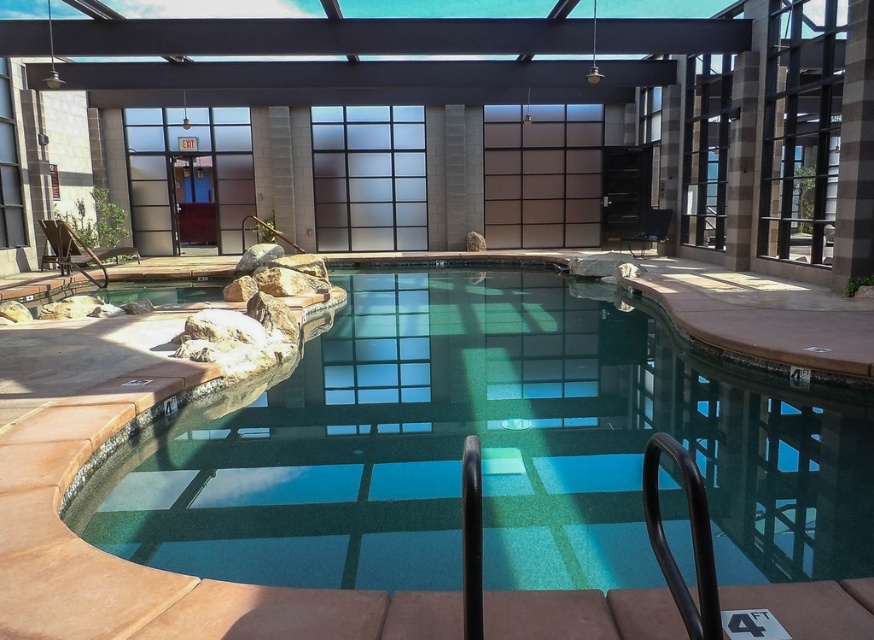
Which is below, transparent glass pool at center or green tile swimming pool at center?

green tile swimming pool at center is lower down.

Which of these two, transparent glass pool at center or green tile swimming pool at center, stands taller?

transparent glass pool at center is taller.

Who is more distant from viewer, (812, 125) or (348, 508)?

The point (812, 125) is behind.

The width and height of the screenshot is (874, 640). In order to click on transparent glass pool at center in this screenshot , I will do `click(491, 124)`.